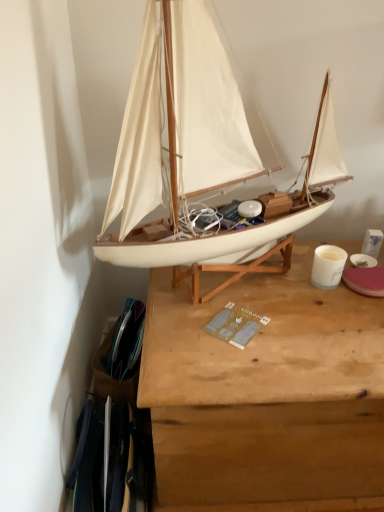
The height and width of the screenshot is (512, 384). Describe the element at coordinates (266, 396) in the screenshot. I see `wooden desk at center` at that location.

This screenshot has height=512, width=384. Identify the location of wooden desk at center. (266, 396).

Identify the location of white matte sailboat at center. (200, 151).

What do you see at coordinates (200, 151) in the screenshot?
I see `white matte sailboat at center` at bounding box center [200, 151].

Image resolution: width=384 pixels, height=512 pixels. What are the coordinates of `wooden desk at center` in the screenshot? It's located at 266,396.

Is wooden desk at center to the left or to the right of white matte sailboat at center in the image?

Clearly, wooden desk at center is on the right of white matte sailboat at center in the image.

Which is in front, wooden desk at center or white matte sailboat at center?

white matte sailboat at center is in front.

Considering the points (153, 354) and (203, 236), which point is behind, point (153, 354) or point (203, 236)?

The point (203, 236) is farther.

From the image's perspective, is wooden desk at center beneath white matte sailboat at center?

Indeed, from the image's perspective, wooden desk at center is shown beneath white matte sailboat at center.

From a real-world perspective, is wooden desk at center on white matte sailboat at center?

Incorrect, from a real-world perspective, wooden desk at center is lower than white matte sailboat at center.

From the picture: Which of these two, wooden desk at center or white matte sailboat at center, is thinner?

white matte sailboat at center is thinner.

Considering the relative sizes of wooden desk at center and white matte sailboat at center in the image provided, is wooden desk at center shorter than white matte sailboat at center?

Yes, wooden desk at center is shorter than white matte sailboat at center.

Considering the sizes of wooden desk at center and white matte sailboat at center in the image, is wooden desk at center bigger or smaller than white matte sailboat at center?

Clearly, wooden desk at center is larger in size than white matte sailboat at center.

Is wooden desk at center situated inside white matte sailboat at center or outside?

wooden desk at center is not enclosed by white matte sailboat at center.

Can you see wooden desk at center touching white matte sailboat at center?

There is a gap between wooden desk at center and white matte sailboat at center.

Is wooden desk at center oriented towards white matte sailboat at center?

No, wooden desk at center is not facing towards white matte sailboat at center.

How different are the orientations of wooden desk at center and white matte sailboat at center in degrees?

There is a 0.266-degree angle between the facing directions of wooden desk at center and white matte sailboat at center.

Measure the distance from wooden desk at center to white matte sailboat at center.

They are 11.19 inches apart.

This screenshot has height=512, width=384. What are the coordinates of `boat above the wooden desk at center (from a real-world perspective)` in the screenshot? It's located at (200, 151).

Would you say white matte sailboat at center is to the left or to the right of wooden desk at center in the picture?

Clearly, white matte sailboat at center is on the left of wooden desk at center in the image.

Is white matte sailboat at center behind wooden desk at center?

No.

Does point (199, 31) lie behind point (382, 255)?

No.

From the image's perspective, is white matte sailboat at center positioned above or below wooden desk at center?

white matte sailboat at center is situated higher than wooden desk at center in the image.

From the picture: From a real-world perspective, is white matte sailboat at center on top of wooden desk at center?

Yes, from a real-world perspective, white matte sailboat at center is above wooden desk at center.

Does white matte sailboat at center have a lesser width compared to wooden desk at center?

Correct, the width of white matte sailboat at center is less than that of wooden desk at center.

In the scene shown: Can you confirm if white matte sailboat at center is taller than wooden desk at center?

Indeed, white matte sailboat at center has a greater height compared to wooden desk at center.

Considering the relative sizes of white matte sailboat at center and wooden desk at center in the image provided, is white matte sailboat at center smaller than wooden desk at center?

Indeed, white matte sailboat at center has a smaller size compared to wooden desk at center.

Is white matte sailboat at center located outside wooden desk at center?

Yes, white matte sailboat at center is outside of wooden desk at center.

Would you consider white matte sailboat at center to be distant from wooden desk at center?

No, there isn't a large distance between white matte sailboat at center and wooden desk at center.

Is white matte sailboat at center oriented away from wooden desk at center?

No, white matte sailboat at center's orientation is not away from wooden desk at center.

How different are the orientations of white matte sailboat at center and wooden desk at center in degrees?

white matte sailboat at center and wooden desk at center are facing 0.266 degrees away from each other.

How distant is white matte sailboat at center from wooden desk at center?

The distance of white matte sailboat at center from wooden desk at center is 11.19 inches.

This screenshot has height=512, width=384. In order to click on desk below the white matte sailboat at center (from the image's perspective) in this screenshot , I will do `click(266, 396)`.

Where is `boat above the wooden desk at center (from a real-world perspective)`? The width and height of the screenshot is (384, 512). boat above the wooden desk at center (from a real-world perspective) is located at coordinates (200, 151).

Where is `boat that is in front of the wooden desk at center`? The height and width of the screenshot is (512, 384). boat that is in front of the wooden desk at center is located at coordinates tap(200, 151).